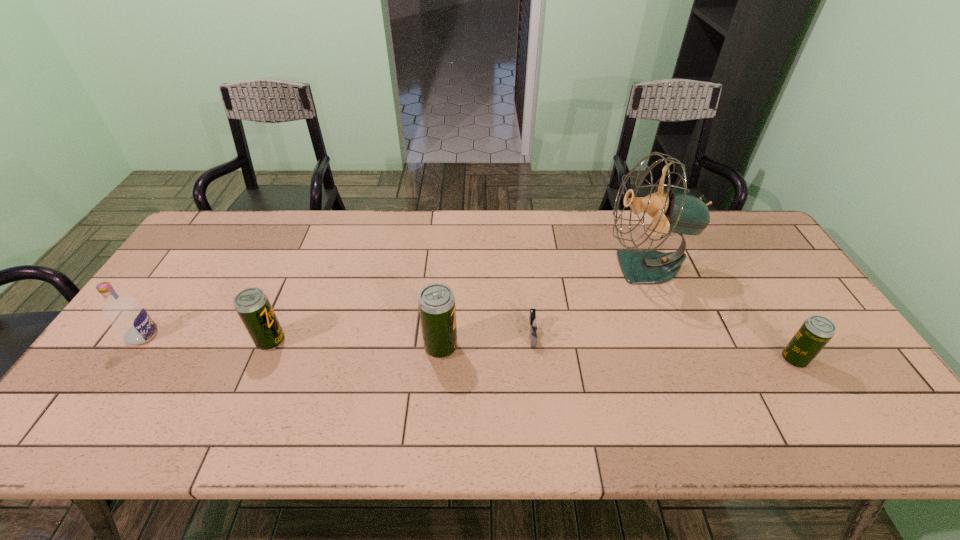
Locate an element on the screen. This screenshot has width=960, height=540. the second object from left to right is located at coordinates (252, 305).

At what (x,y) coordinates should I click in order to perform the action: click on the leftmost beer can. Please return your answer as a coordinate pair (x, y). This screenshot has width=960, height=540. Looking at the image, I should click on (252, 305).

Where is `the second beer can from right to left`? The width and height of the screenshot is (960, 540). the second beer can from right to left is located at coordinates (436, 302).

This screenshot has width=960, height=540. Identify the location of the shortest beer can. (816, 331).

Where is `the rightmost object`? The height and width of the screenshot is (540, 960). the rightmost object is located at coordinates (816, 331).

I want to click on igniter, so click(534, 324).

Locate an element on the screen. The width and height of the screenshot is (960, 540). the fourth object from left to right is located at coordinates 534,324.

You are a GUI agent. You are given a task and a screenshot of the screen. Output one action in this format:
    pyautogui.click(x=<x>, y=<y>)
    Task: Click on the tallest object
    This screenshot has width=960, height=540.
    Given the screenshot: What is the action you would take?
    pyautogui.click(x=673, y=211)

Locate an element on the screen. The height and width of the screenshot is (540, 960). the farthest object is located at coordinates (673, 211).

Where is `vodka`? This screenshot has width=960, height=540. vodka is located at coordinates point(124,313).